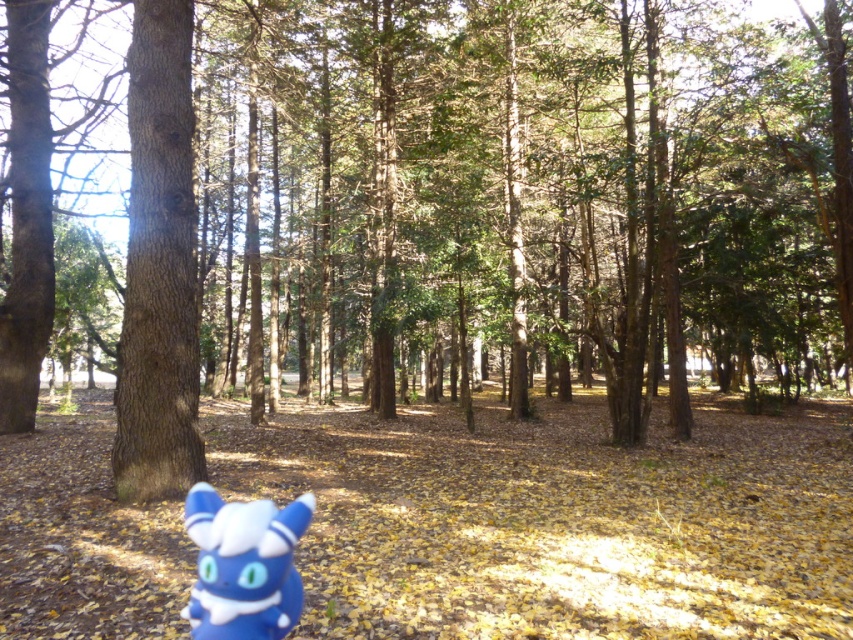
Can you confirm if smooth brown tree trunk at center is positioned above blue plush toy at lower left?

No, smooth brown tree trunk at center is not above blue plush toy at lower left.

Does smooth brown tree trunk at center have a larger size compared to blue plush toy at lower left?

Actually, smooth brown tree trunk at center might be smaller than blue plush toy at lower left.

This screenshot has width=853, height=640. Find the location of `smooth brown tree trunk at center`. smooth brown tree trunk at center is located at coordinates (158, 266).

You are a GUI agent. You are given a task and a screenshot of the screen. Output one action in this format:
    pyautogui.click(x=<x>, y=<y>)
    Task: Click on the smooth brown tree trunk at center
    This screenshot has height=640, width=853.
    Given the screenshot: What is the action you would take?
    pyautogui.click(x=158, y=266)